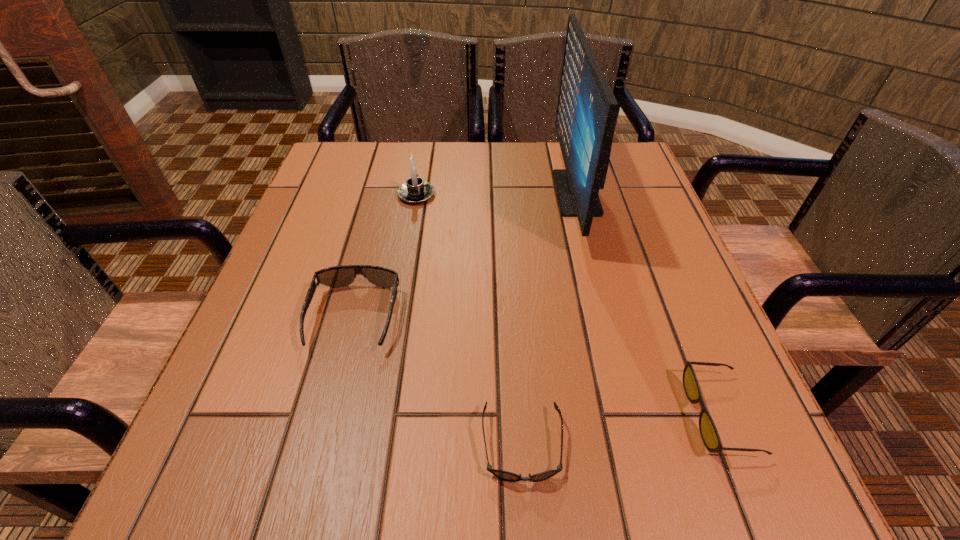
Locate an element on the screen. This screenshot has height=540, width=960. object that is at the left edge is located at coordinates (337, 276).

What are the coordinates of `computer monitor positioned at the right edge` in the screenshot? It's located at (586, 114).

In order to click on sunglasses at the right edge in this screenshot , I will do `click(708, 431)`.

Find the location of `object present at the far right corner`. object present at the far right corner is located at coordinates (586, 114).

At what (x,y) coordinates should I click in order to perform the action: click on object located in the near right corner section of the desktop. Please return your answer as a coordinate pair (x, y). The height and width of the screenshot is (540, 960). Looking at the image, I should click on (708, 431).

At what (x,y) coordinates should I click in order to perform the action: click on free space at the far edge. Please return your answer as a coordinate pair (x, y). The height and width of the screenshot is (540, 960). Looking at the image, I should click on (525, 153).

Locate an element on the screen. This screenshot has width=960, height=540. vacant region at the near edge of the desktop is located at coordinates (532, 459).

What are the coordinates of `vacant region at the left edge of the desktop` in the screenshot? It's located at (334, 217).

You are a GUI agent. You are given a task and a screenshot of the screen. Output one action in this format:
    pyautogui.click(x=<x>, y=<y>)
    Task: Click on the vacant space at the right edge
    This screenshot has height=540, width=960.
    Given the screenshot: What is the action you would take?
    pyautogui.click(x=669, y=321)

At what (x,y) coordinates should I click in order to perform the action: click on free space at the far left corner. Please return your answer as a coordinate pair (x, y). Looking at the image, I should click on (373, 188).